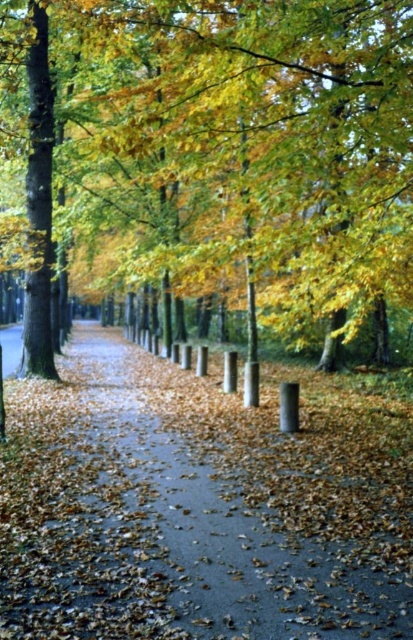
You are a painter standing on the smooth asphalt pavement at center, looking up at the golden leafy tree at center. Which object is taller?

The golden leafy tree at center is taller than the smooth asphalt pavement at center.

You are walking along the pathway in the autumn scene and want to reach a specific point. If you are currently at point (2,564), which direction should you face to move towards point (42,257)?

You should face backward because point (42,257) is behind point (2,564).